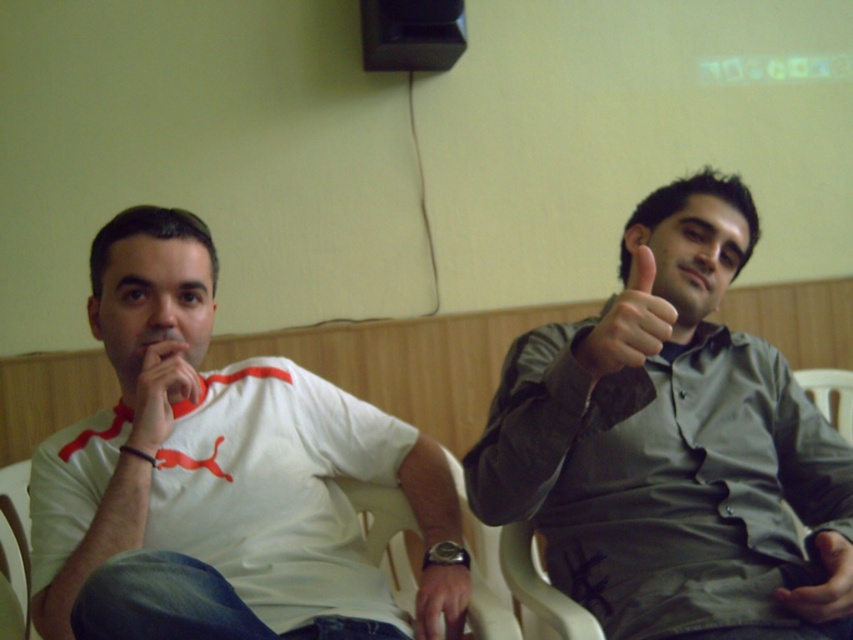
Is matte skin hand at upper right wider than matte black hand at center?

Indeed, matte skin hand at upper right has a greater width compared to matte black hand at center.

Is point (596, 376) more distant than point (815, 552)?

No, (596, 376) is closer to viewer.

Find the location of a particular element. matte skin hand at upper right is located at coordinates (630, 323).

Which is behind, point (177, 385) or point (442, 611)?

Point (442, 611)

Does matte white hand at center have a lesser width compared to smooth leather watch at lower center?

No, matte white hand at center is not thinner than smooth leather watch at lower center.

Who is more distant from viewer, (132,410) or (440,566)?

The point (132,410) is more distant.

This screenshot has height=640, width=853. Find the location of `matte white hand at center`. matte white hand at center is located at coordinates (160, 392).

Can you confirm if gray matte shirt at upper right is positioned below smooth leather watch at lower center?

No.

Which is in front, point (590, 497) or point (422, 598)?

Point (422, 598) is in front.

Who is more distant from viewer, (672, 196) or (427, 620)?

Point (672, 196)

At what (x,y) coordinates should I click in order to perform the action: click on gray matte shirt at upper right. Please return your answer as a coordinate pair (x, y). Image resolution: width=853 pixels, height=640 pixels. Looking at the image, I should click on (666, 442).